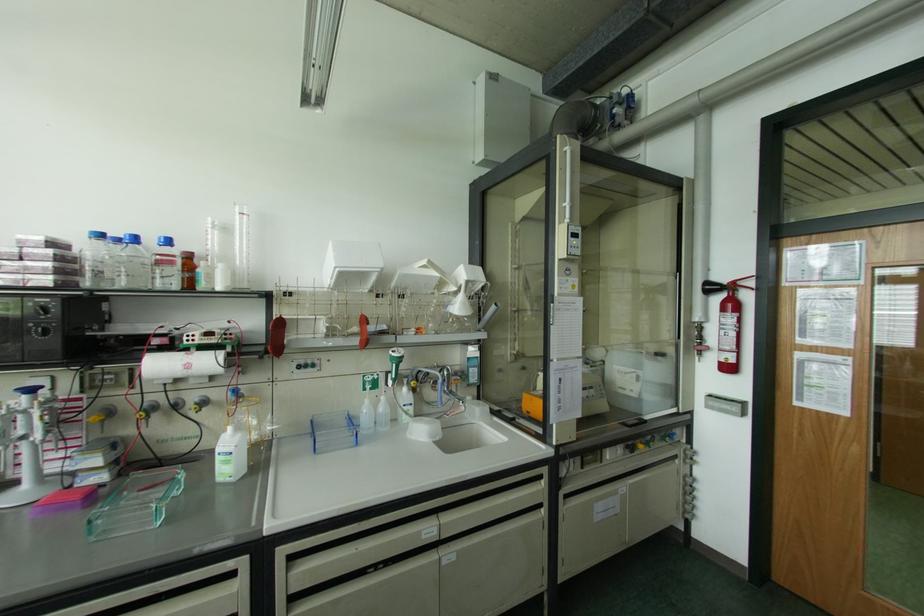
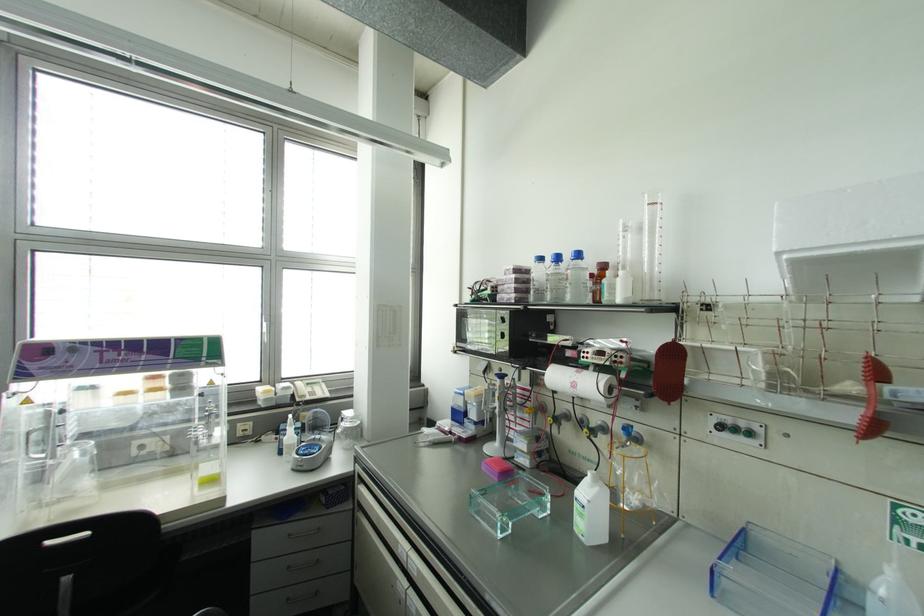
Question: Based on the continuous images, in which direction is the camera rotating? Reply with the corresponding letter.

Choices:
 (A) Left
 (B) Right
 (C) Up
 (D) Down

Answer: (A)